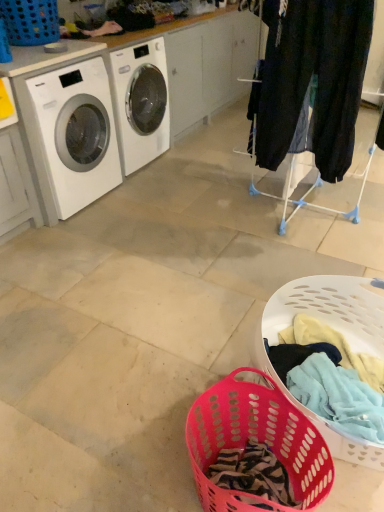
Question: Considering the relative sizes of pink plastic laundry basket at lower center, the second basket positioned from the back, and blue plastic laundry basket at upper left, the third basket viewed from the right, in the image provided, is pink plastic laundry basket at lower center, the second basket positioned from the back, wider than blue plastic laundry basket at upper left, the third basket viewed from the right,?

Choices:
 (A) yes
 (B) no

Answer: (A)

Question: Are pink plastic laundry basket at lower center, which ranks as the 2th basket in front-to-back order, and blue plastic laundry basket at upper left, acting as the 1th basket starting from the back, beside each other?

Choices:
 (A) no
 (B) yes

Answer: (A)

Question: Would you say pink plastic laundry basket at lower center, acting as the 1th basket starting from the right, is a long distance from blue plastic laundry basket at upper left, the third basket viewed from the right?

Choices:
 (A) yes
 (B) no

Answer: (A)

Question: Does pink plastic laundry basket at lower center, positioned as the second basket in bottom-to-top order, lie behind blue plastic laundry basket at upper left, acting as the 1th basket starting from the back?

Choices:
 (A) yes
 (B) no

Answer: (B)

Question: Is pink plastic laundry basket at lower center, the second basket positioned from the back, looking in the opposite direction of blue plastic laundry basket at upper left, the first basket positioned from the left?

Choices:
 (A) no
 (B) yes

Answer: (A)

Question: Can you confirm if pink plastic laundry basket at lower center, acting as the 1th basket starting from the right, is smaller than blue plastic laundry basket at upper left, the 3th basket from the front?

Choices:
 (A) yes
 (B) no

Answer: (B)

Question: From a real-world perspective, is blue plastic laundry basket at upper left, the first basket positioned from the left, on top of translucent plastic laundry basket at lower center, the 1th basket in the front-to-back sequence?

Choices:
 (A) no
 (B) yes

Answer: (B)

Question: Does blue plastic laundry basket at upper left, the third basket viewed from the right, come in front of translucent plastic laundry basket at lower center, the 1th basket in the front-to-back sequence?

Choices:
 (A) yes
 (B) no

Answer: (B)

Question: Is blue plastic laundry basket at upper left, acting as the 1th basket starting from the back, facing towards translucent plastic laundry basket at lower center, which ranks as the 3th basket in top-to-bottom order?

Choices:
 (A) yes
 (B) no

Answer: (B)

Question: Is blue plastic laundry basket at upper left, the 1th basket when ordered from top to bottom, at the left side of translucent plastic laundry basket at lower center, acting as the 1th basket starting from the bottom?

Choices:
 (A) no
 (B) yes

Answer: (B)

Question: Can we say blue plastic laundry basket at upper left, the first basket positioned from the left, lies outside translucent plastic laundry basket at lower center, the 2th basket from the left?

Choices:
 (A) no
 (B) yes

Answer: (B)

Question: From a real-world perspective, is blue plastic laundry basket at upper left, the 3th basket from the front, physically below translucent plastic laundry basket at lower center, the 1th basket in the front-to-back sequence?

Choices:
 (A) yes
 (B) no

Answer: (B)

Question: Is pink plastic laundry basket at lower center, which ranks as the 2th basket in front-to-back order, outside of dark blue jeans at right?

Choices:
 (A) yes
 (B) no

Answer: (A)